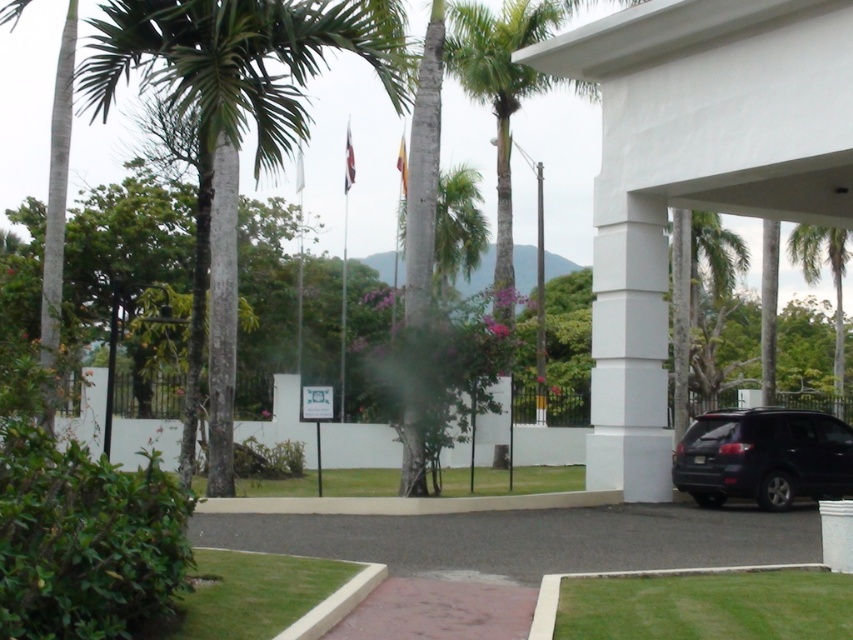
Can you confirm if green textured palm tree at center is positioned above dark gray asphalt at center?

Yes.

Is green textured palm tree at center wider than dark gray asphalt at center?

Yes.

In order to click on green textured palm tree at center in this screenshot , I will do `click(236, 115)`.

Which of these two, black matte suv at lower right or metallic flag pole at center, stands shorter?

Standing shorter between the two is black matte suv at lower right.

Is point (701, 417) positioned in front of point (346, 246)?

Yes, it is in front of point (346, 246).

You are a GUI agent. You are given a task and a screenshot of the screen. Output one action in this format:
    pyautogui.click(x=<x>, y=<y>)
    Task: Click on the black matte suv at lower right
    
    Given the screenshot: What is the action you would take?
    pyautogui.click(x=763, y=456)

Does green textured palm tree at center appear over green leafy palm tree at center?

Correct, green textured palm tree at center is located above green leafy palm tree at center.

Who is shorter, green textured palm tree at center or green leafy palm tree at center?

Standing shorter between the two is green leafy palm tree at center.

Between point (265, 20) and point (677, 296), which one is positioned in front?

Point (265, 20) is more forward.

Locate an element on the screen. This screenshot has height=640, width=853. green textured palm tree at center is located at coordinates (236, 115).